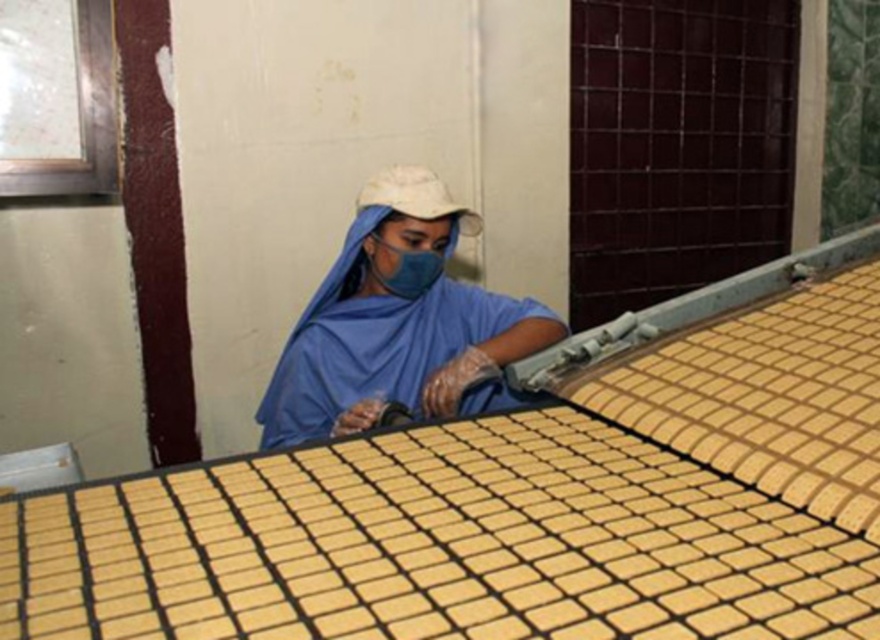
You are a quality inspector in a food processing facility. You need to check two points on the conveyor belt for any defects. The points are labeled as point 1 at coordinates point 1 at coordinates point (295, 378) and point 2 at coordinates point (424, 236). Since you can only check one point at a time, which point should you check first to ensure you don t have to walk further back than necessary?

You should check point 1 at coordinates point (295, 378) first because it is closer to you than point 2 at coordinates point (424, 236). This way, you won t have to walk further back to reach it after checking the other point.

You are a safety inspector in the food processing facility. You notice two blue fabric items worn by the worker at the conveyor belt. Which one is taller between the blue fabric robe at center and the blue fabric mask at center?

The blue fabric robe at center is taller than the blue fabric mask at center.